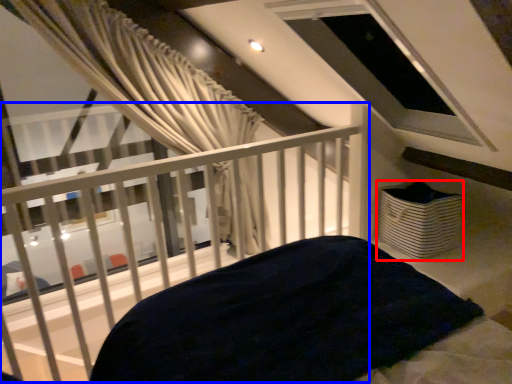
Question: Which object appears closest to the camera in this image, basket (highlighted by a red box) or balcony (highlighted by a blue box)?

Choices:
 (A) basket
 (B) balcony

Answer: (B)